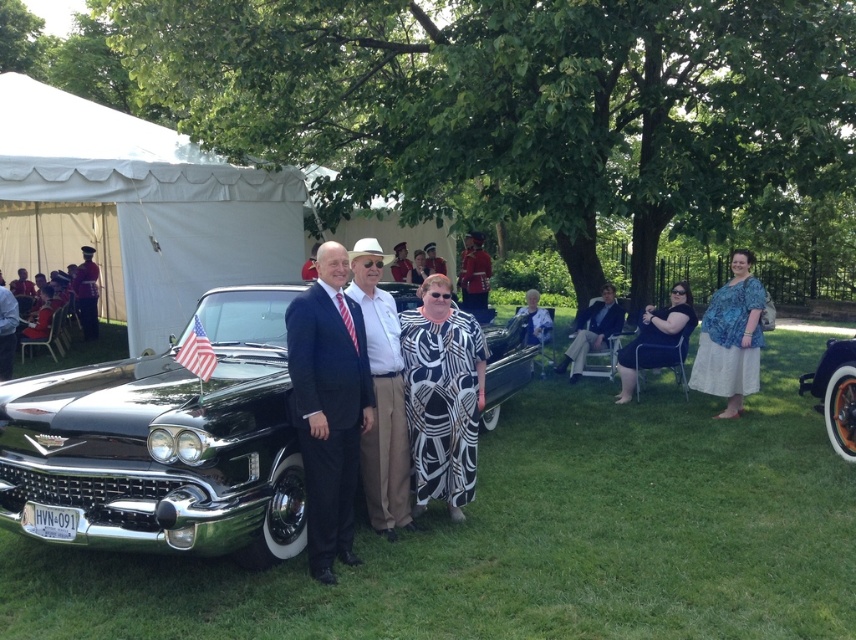
Does patterned fabric dress at center appear on the right side of matte black suit at center?

Yes, patterned fabric dress at center is to the right of matte black suit at center.

Does patterned fabric dress at center appear over matte black suit at center?

No.

Describe the element at coordinates (592, 332) in the screenshot. I see `patterned fabric dress at center` at that location.

You are a GUI agent. You are given a task and a screenshot of the screen. Output one action in this format:
    pyautogui.click(x=<x>, y=<y>)
    Task: Click on the patterned fabric dress at center
    The height and width of the screenshot is (640, 856).
    Given the screenshot: What is the action you would take?
    pyautogui.click(x=592, y=332)

Does matte black dress at lower right appear on the right side of patterned fabric dress at center?

Yes, matte black dress at lower right is to the right of patterned fabric dress at center.

Is point (669, 348) in front of point (578, 316)?

Yes, it is.

Which is in front, point (627, 346) or point (611, 300)?

Point (627, 346) is in front.

Find the location of a particular element. Image resolution: width=856 pixels, height=640 pixels. matte black dress at lower right is located at coordinates (657, 339).

I want to click on dark blue suit at center, so click(x=328, y=406).

Does dark blue suit at center appear over blue printed blouse at right?

Incorrect, dark blue suit at center is not positioned above blue printed blouse at right.

Locate an element on the screen. The height and width of the screenshot is (640, 856). dark blue suit at center is located at coordinates 328,406.

The height and width of the screenshot is (640, 856). Identify the location of dark blue suit at center. (328, 406).